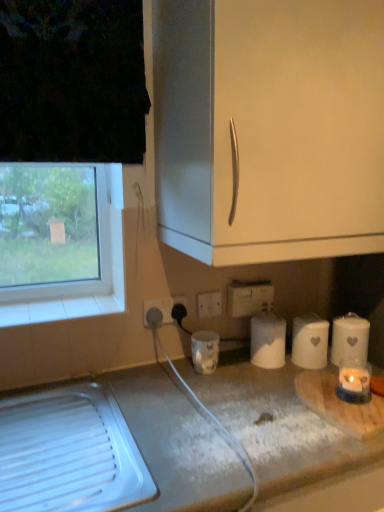
Locate an element on the screen. The width and height of the screenshot is (384, 512). blank area to the left of translucent glass candle at lower right is located at coordinates (269, 399).